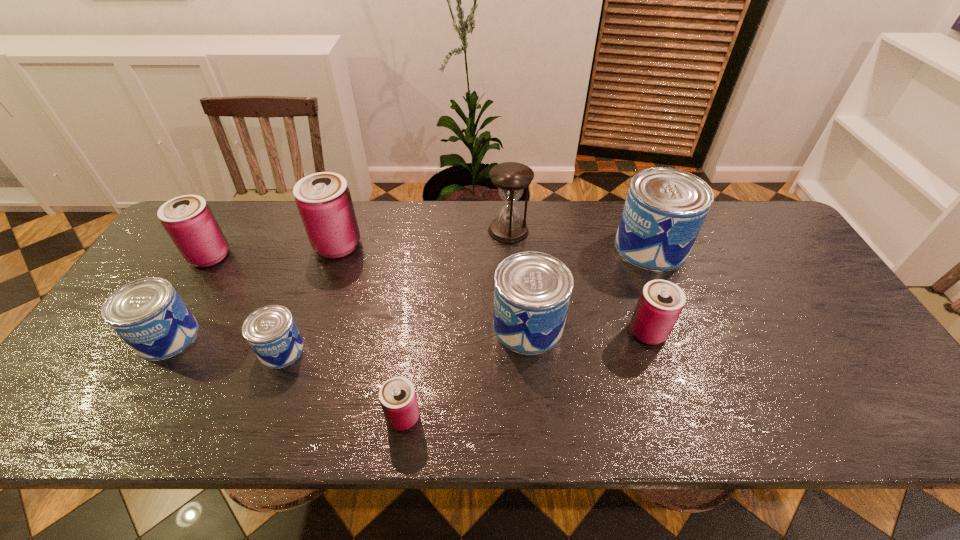
At what (x,y) coordinates should I click in order to perform the action: click on vacant area that lies between the third biggest blue can and the third smallest pink can. Please return your answer as a coordinate pair (x, y). The height and width of the screenshot is (540, 960). Looking at the image, I should click on (189, 296).

Select which object is the closest to the second biggest blue can. Please provide its 2D coordinates. Your answer should be formatted as a tuple, i.e. [(x, y)], where the tuple contains the x and y coordinates of a point satisfying the conditions above.

[(661, 302)]

At what (x,y) coordinates should I click in order to perform the action: click on object that is the seventh closest to the hourglass. Please return your answer as a coordinate pair (x, y). The width and height of the screenshot is (960, 540). Looking at the image, I should click on (188, 220).

Select which can is the closest to the second smallest blue can. Please provide its 2D coordinates. Your answer should be formatted as a tuple, i.e. [(x, y)], where the tuple contains the x and y coordinates of a point satisfying the conditions above.

[(188, 220)]

Locate which can is the closest to the third blue can from right to left. Please provide its 2D coordinates. Your answer should be formatted as a tuple, i.e. [(x, y)], where the tuple contains the x and y coordinates of a point satisfying the conditions above.

[(148, 314)]

Identify the location of the closest pink can to the third pink can from left to right. (323, 199).

At what (x,y) coordinates should I click in order to perform the action: click on pink can that is the second nearest to the second biggest pink can. Please return your answer as a coordinate pair (x, y). Looking at the image, I should click on (397, 395).

Identify the location of blue can that is the fourth nearest to the biggest pink can. (665, 208).

Where is `blue can object that ranks as the second closest to the rightmost blue can`? Image resolution: width=960 pixels, height=540 pixels. blue can object that ranks as the second closest to the rightmost blue can is located at coordinates (271, 332).

Where is `free point that satisfies the following two spatial constraints: 1. on the back side of the fourth can from right to left; 2. on the right side of the hourglass`? free point that satisfies the following two spatial constraints: 1. on the back side of the fourth can from right to left; 2. on the right side of the hourglass is located at coordinates (427, 231).